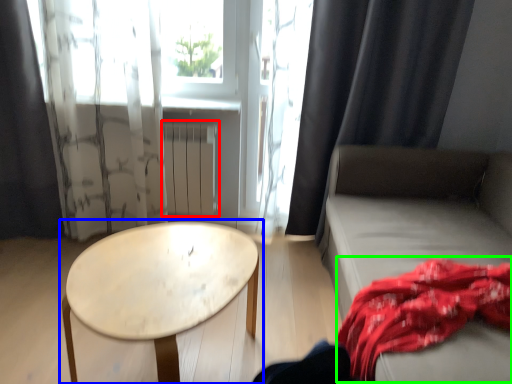
Question: Which object is the farthest from radiator (highlighted by a red box)? Choose among these: table (highlighted by a blue box) or blanket (highlighted by a green box).

Choices:
 (A) table
 (B) blanket

Answer: (B)